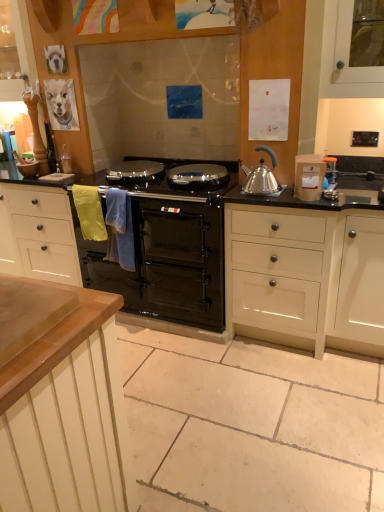
What is the approximate height of satin silver kettle at right?

The height of satin silver kettle at right is 10.09 inches.

Measure the distance between point (369, 274) and camera.

Point (369, 274) and camera are 2.14 meters apart from each other.

Find the location of `black glass oven at center`. black glass oven at center is located at coordinates (166, 263).

What do you see at coordinates (166, 263) in the screenshot?
I see `black glass oven at center` at bounding box center [166, 263].

In order to face wooden cabinet at upper left, which is the first cabinetry in top-to-bottom order, should I rotate leftwards or rightwards?

Rotate left and turn 23.543 degrees.

Identify the location of white matte container at right. This screenshot has width=384, height=512. (309, 176).

The image size is (384, 512). What are the coordinates of `satin silver kettle at right` in the screenshot? It's located at tap(260, 180).

Which of these two, satin silver kettle at right or wooden cabinet at upper left, placed as the 1th cabinetry when sorted from left to right, is bigger?

wooden cabinet at upper left, placed as the 1th cabinetry when sorted from left to right, is bigger.

Does satin silver kettle at right lie behind wooden cabinet at upper left, placed as the second cabinetry when sorted from right to left?

No, satin silver kettle at right is closer to the viewer.

Which object is positioned more to the left, satin silver kettle at right or wooden cabinet at upper left, placed as the second cabinetry when sorted from right to left?

wooden cabinet at upper left, placed as the second cabinetry when sorted from right to left.

This screenshot has width=384, height=512. Find the location of `kitchen appliance on the right side of wooden cabinet at upper left, placed as the second cabinetry when sorted from right to left`. kitchen appliance on the right side of wooden cabinet at upper left, placed as the second cabinetry when sorted from right to left is located at coordinates tap(260, 180).

Is point (316, 174) behind point (110, 276)?

No.

The height and width of the screenshot is (512, 384). What are the coordinates of `oven lying behind the white matte container at right` in the screenshot? It's located at (166, 263).

From a real-world perspective, between white matte container at right and black glass oven at center, who is vertically lower?

In real-world perspective, black glass oven at center is lower.

Is white matte container at right inside the boundaries of black glass oven at center, or outside?

white matte container at right is outside black glass oven at center.

From the image's perspective, between white matte cabinet at right, the 1th cabinetry positioned from the bottom, and black glass oven at center, who is located below?

From the image's view, white matte cabinet at right, the 1th cabinetry positioned from the bottom, is below.

Is point (372, 307) more distant than point (93, 267)?

No.

Which of these two, white matte cabinet at right, the 1th cabinetry positioned from the bottom, or black glass oven at center, stands shorter?

Standing shorter between the two is black glass oven at center.

Is white matte cabinet at right, which is the first cabinetry from right to left, wider than black glass oven at center?

No, white matte cabinet at right, which is the first cabinetry from right to left, is not wider than black glass oven at center.

How distant is white matte cabinet at right, which is the first cabinetry from right to left, from satin silver kettle at right?

The distance of white matte cabinet at right, which is the first cabinetry from right to left, from satin silver kettle at right is 46.13 centimeters.

Is white matte cabinet at right, the 1th cabinetry positioned from the bottom, bigger than satin silver kettle at right?

Indeed, white matte cabinet at right, the 1th cabinetry positioned from the bottom, has a larger size compared to satin silver kettle at right.

This screenshot has width=384, height=512. I want to click on cabinetry that appears below the satin silver kettle at right (from a real-world perspective), so click(305, 277).

Is white matte cabinet at right, which is the first cabinetry from right to left, inside the boundaries of satin silver kettle at right, or outside?

white matte cabinet at right, which is the first cabinetry from right to left, is spatially situated outside satin silver kettle at right.

Which is in front, point (173, 274) or point (269, 190)?

The point (269, 190) is more forward.

From the image's perspective, is black glass oven at center above or below satin silver kettle at right?

black glass oven at center is situated lower than satin silver kettle at right in the image.

From the picture: Who is shorter, black glass oven at center or satin silver kettle at right?

Standing shorter between the two is satin silver kettle at right.

Between black glass oven at center and satin silver kettle at right, which one is positioned behind?

black glass oven at center is more distant.

From the image's perspective, would you say black glass oven at center is positioned over white matte cabinet at right, which ranks as the 2th cabinetry in top-to-bottom order?

Indeed, from the image's perspective, black glass oven at center is shown above white matte cabinet at right, which ranks as the 2th cabinetry in top-to-bottom order.

Would you say black glass oven at center is inside or outside white matte cabinet at right, the 2th cabinetry positioned from the left?

black glass oven at center is not inside white matte cabinet at right, the 2th cabinetry positioned from the left, it's outside.

What are the coordinates of `cabinetry in front of the black glass oven at center` in the screenshot? It's located at (305, 277).

How different are the orientations of black glass oven at center and white matte cabinet at right, which is the first cabinetry from right to left, in degrees?

The angular difference between black glass oven at center and white matte cabinet at right, which is the first cabinetry from right to left, is 0.000228 degrees.

Based on the photo, who is smaller, wooden cabinet at upper left, which is counted as the 2th cabinetry, starting from the bottom, or black glass oven at center?

wooden cabinet at upper left, which is counted as the 2th cabinetry, starting from the bottom, is smaller.

The height and width of the screenshot is (512, 384). Identify the location of cabinetry that appears on the left of black glass oven at center. (23, 39).

Can you confirm if wooden cabinet at upper left, which is the first cabinetry in top-to-bottom order, is wider than black glass oven at center?

In fact, wooden cabinet at upper left, which is the first cabinetry in top-to-bottom order, might be narrower than black glass oven at center.

From a real-world perspective, is wooden cabinet at upper left, placed as the 1th cabinetry when sorted from left to right, on black glass oven at center?

Indeed, from a real-world perspective, wooden cabinet at upper left, placed as the 1th cabinetry when sorted from left to right, stands above black glass oven at center.

Identify the location of kitchen appliance below the wooden cabinet at upper left, which is counted as the 2th cabinetry, starting from the bottom (from a real-world perspective). (260, 180).

The image size is (384, 512). Find the location of `oven lying behind the white matte container at right`. oven lying behind the white matte container at right is located at coordinates 166,263.

Based on their spatial positions, is white matte cabinet at right, which ranks as the 2th cabinetry in top-to-bottom order, or satin silver kettle at right further from black glass oven at center?

satin silver kettle at right is positioned further to the anchor black glass oven at center.

When comparing their distances from black glass oven at center, does wooden cabinet at upper left, which is the first cabinetry in top-to-bottom order, or satin silver kettle at right seem closer?

satin silver kettle at right.

From the image, which object appears to be nearer to satin silver kettle at right, white matte container at right or white matte cabinet at right, which is the first cabinetry from right to left?

white matte container at right.

Estimate the real-world distances between objects in this image. Which object is further from wooden cabinet at upper left, placed as the second cabinetry when sorted from right to left, satin silver kettle at right or white matte container at right?

white matte container at right is positioned further to the anchor wooden cabinet at upper left, placed as the second cabinetry when sorted from right to left.

Looking at the image, which one is located closer to black glass oven at center, satin silver kettle at right or white matte cabinet at right, which is the first cabinetry from right to left?

white matte cabinet at right, which is the first cabinetry from right to left, is closer to black glass oven at center.

In the scene shown: Considering their positions, is satin silver kettle at right positioned closer to white matte cabinet at right, which ranks as the 2th cabinetry in top-to-bottom order, than black glass oven at center?

The object closer to white matte cabinet at right, which ranks as the 2th cabinetry in top-to-bottom order, is black glass oven at center.

Considering their positions, is black glass oven at center positioned further to white matte cabinet at right, the 2th cabinetry positioned from the left, than satin silver kettle at right?

satin silver kettle at right is positioned further to the anchor white matte cabinet at right, the 2th cabinetry positioned from the left.

Which object lies nearer to the anchor point black glass oven at center, satin silver kettle at right or wooden cabinet at upper left, placed as the 1th cabinetry when sorted from left to right?

satin silver kettle at right lies closer to black glass oven at center than the other object.

The width and height of the screenshot is (384, 512). Find the location of `appliance between satin silver kettle at right and white matte cabinet at right, which is the first cabinetry from right to left, vertically`. appliance between satin silver kettle at right and white matte cabinet at right, which is the first cabinetry from right to left, vertically is located at coordinates (309, 176).

Where is `kitchen appliance situated between black glass oven at center and white matte container at right from left to right`? The image size is (384, 512). kitchen appliance situated between black glass oven at center and white matte container at right from left to right is located at coordinates (260, 180).

In order to click on appliance between wooden cabinet at upper left, placed as the 1th cabinetry when sorted from left to right, and white matte cabinet at right, which ranks as the 2th cabinetry in top-to-bottom order in this screenshot , I will do `click(309, 176)`.

Locate an element on the screen. Image resolution: width=384 pixels, height=512 pixels. kitchen appliance situated between wooden cabinet at upper left, placed as the 1th cabinetry when sorted from left to right, and white matte container at right from left to right is located at coordinates (260, 180).